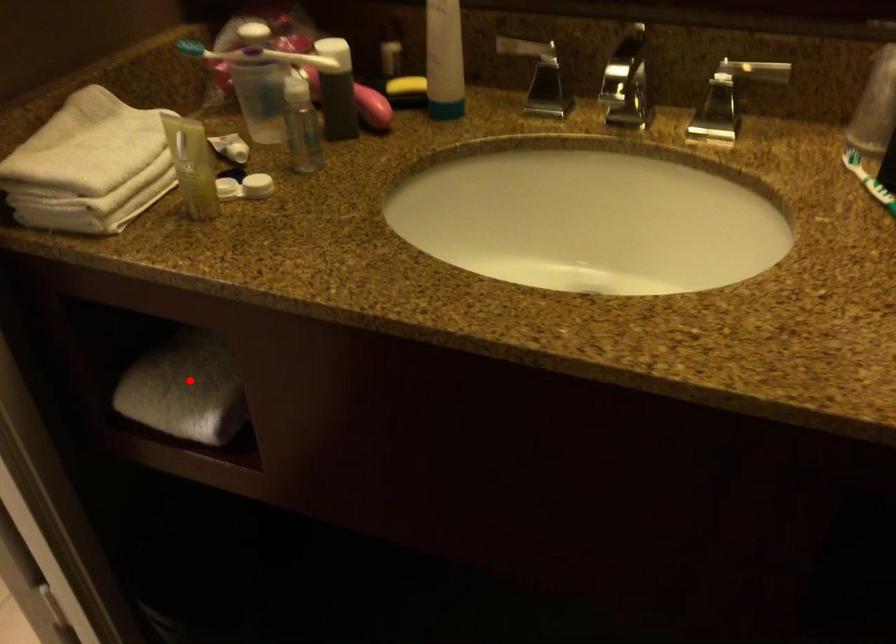
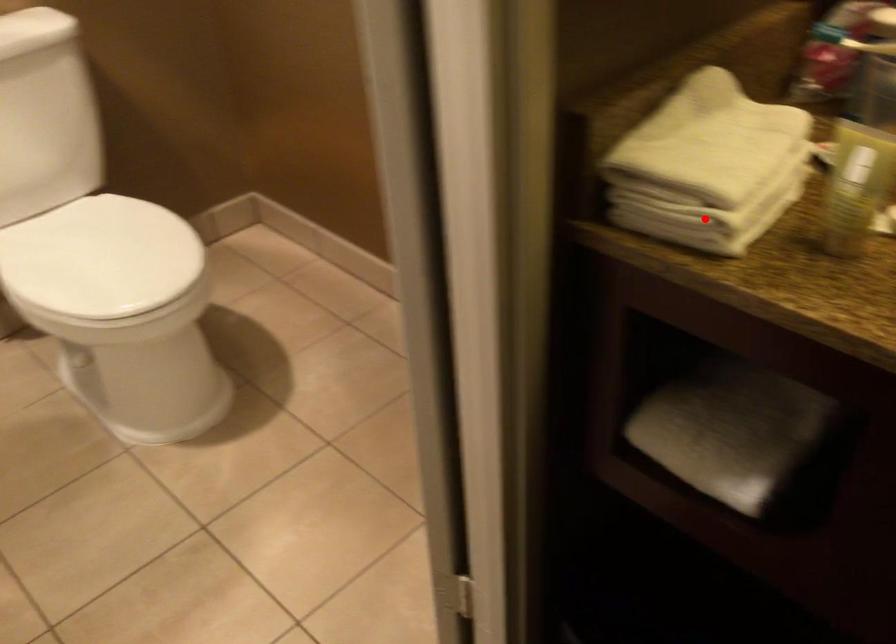
I am providing you with two images of the same scene from different viewpoints. A red point is marked on the first image and another point is marked on the second image. Is the red point in image1 aligned with the point shown in image2?

No